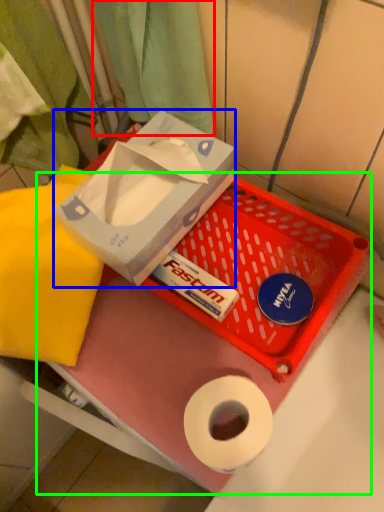
Question: Which object is positioned closest to curtain (highlighted by a red box)? Select from box (highlighted by a blue box) and box (highlighted by a green box).

Choices:
 (A) box
 (B) box

Answer: (A)